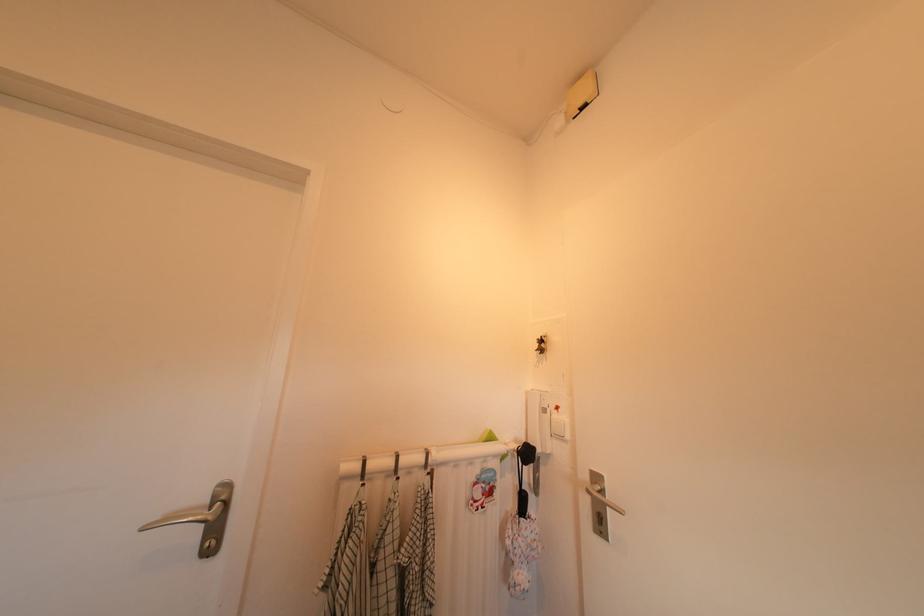
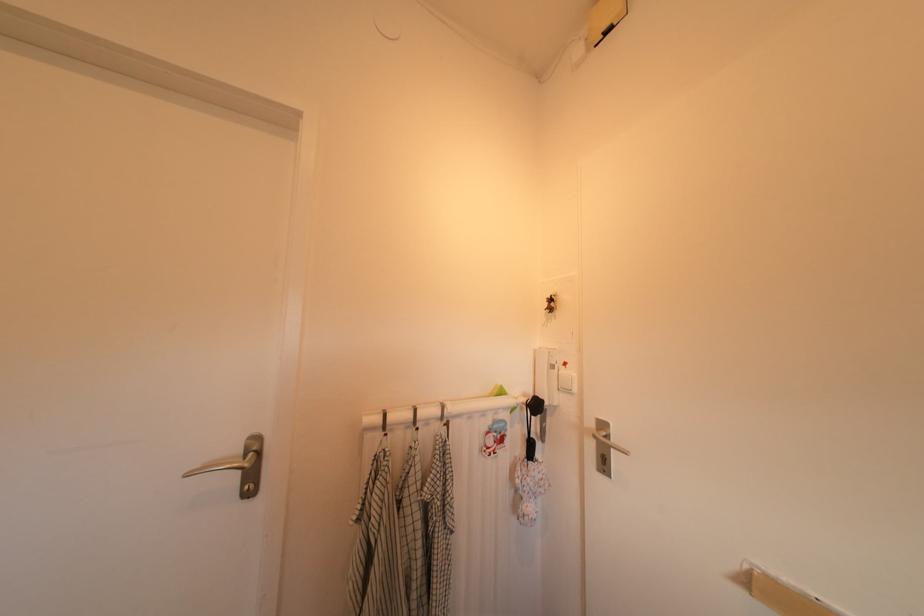
Question: The first image is from the beginning of the video and the second image is from the end. How did the camera likely rotate when shooting the video?

Choices:
 (A) Left
 (B) Right
 (C) Up
 (D) Down

Answer: (D)